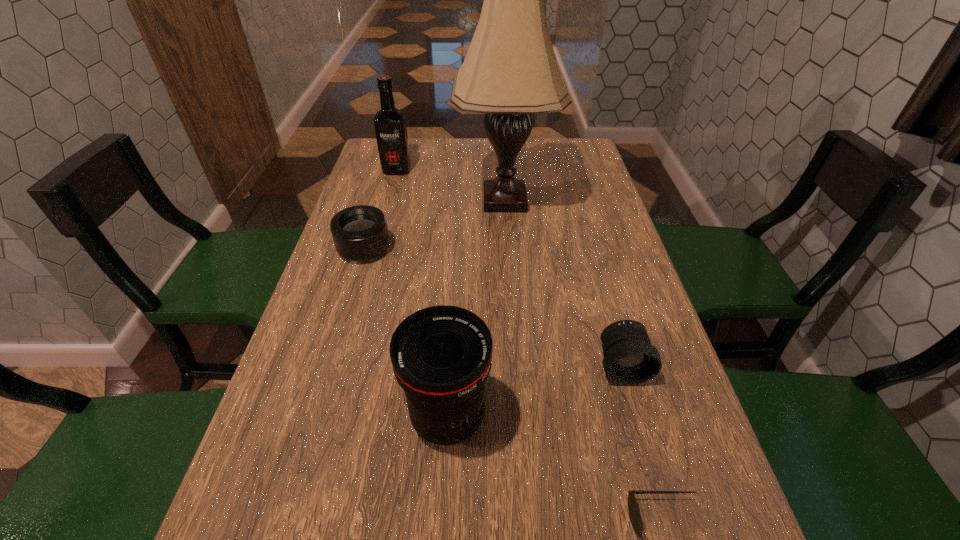
Locate an element on the screen. The width and height of the screenshot is (960, 540). the tallest object is located at coordinates (510, 72).

At what (x,y) coordinates should I click in order to perform the action: click on the second tallest object. Please return your answer as a coordinate pair (x, y). This screenshot has width=960, height=540. Looking at the image, I should click on (390, 126).

You are a GUI agent. You are given a task and a screenshot of the screen. Output one action in this format:
    pyautogui.click(x=<x>, y=<y>)
    Task: Click on the tallest telephoto lens
    
    Given the screenshot: What is the action you would take?
    pyautogui.click(x=441, y=356)

This screenshot has width=960, height=540. I want to click on the second telephoto lens from left to right, so click(441, 356).

Locate an element on the screen. the rightmost telephoto lens is located at coordinates (629, 358).

At what (x,y) coordinates should I click in order to perform the action: click on the leftmost telephoto lens. Please return your answer as a coordinate pair (x, y). This screenshot has width=960, height=540. Looking at the image, I should click on (360, 233).

You are a GUI agent. You are given a task and a screenshot of the screen. Output one action in this format:
    pyautogui.click(x=<x>, y=<y>)
    Task: Click on the fourth nearest object
    The image size is (960, 540).
    Given the screenshot: What is the action you would take?
    pyautogui.click(x=360, y=233)

This screenshot has height=540, width=960. Find the location of `vacant space located 0.140m on the back of the lamp`. vacant space located 0.140m on the back of the lamp is located at coordinates (501, 154).

Where is `vacant space located on the front-facing side of the second tallest object`? This screenshot has width=960, height=540. vacant space located on the front-facing side of the second tallest object is located at coordinates (375, 249).

What are the coordinates of `free location located 0.370m on the back of the fourth shortest object` in the screenshot? It's located at (457, 257).